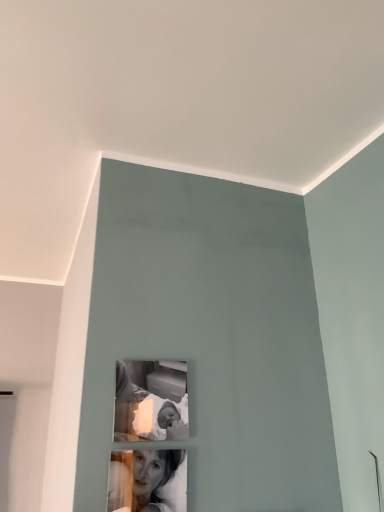
You are a GUI agent. You are given a task and a screenshot of the screen. Output one action in this format:
    pyautogui.click(x=<x>, y=<y>)
    Task: Click on the black glossy photo at lower center
    The image size is (384, 512).
    Given the screenshot: What is the action you would take?
    pyautogui.click(x=148, y=480)

The height and width of the screenshot is (512, 384). What do you see at coordinates (148, 480) in the screenshot?
I see `black glossy photo at lower center` at bounding box center [148, 480].

Identify the location of black glossy photo at lower center. The width and height of the screenshot is (384, 512). (148, 480).